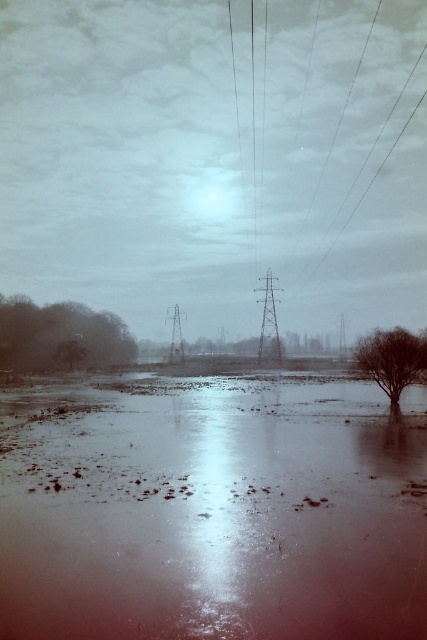
You are a bird flying over the serene landscape. You see the metallic wires at upper right and the green matte tree at lower left. Which object is closer to you as you fly above?

The metallic wires at upper right are closer to you because they are positioned further to the viewer than the green matte tree at lower left, meaning they appear nearer in the scene.

You are standing on the edge of the water and want to take a photo of the green matte tree at lower left and the shiny reflective water at center. Which object will appear larger in the photo?

The green matte tree at lower left will appear larger in the photo because it has a greater height than the shiny reflective water at center.

You are an engineer inspecting the scene and notice the metallic wires at upper right. Based on their position, can you determine their exact coordinates in the image?

The metallic wires at upper right are located at coordinates point (321,131).